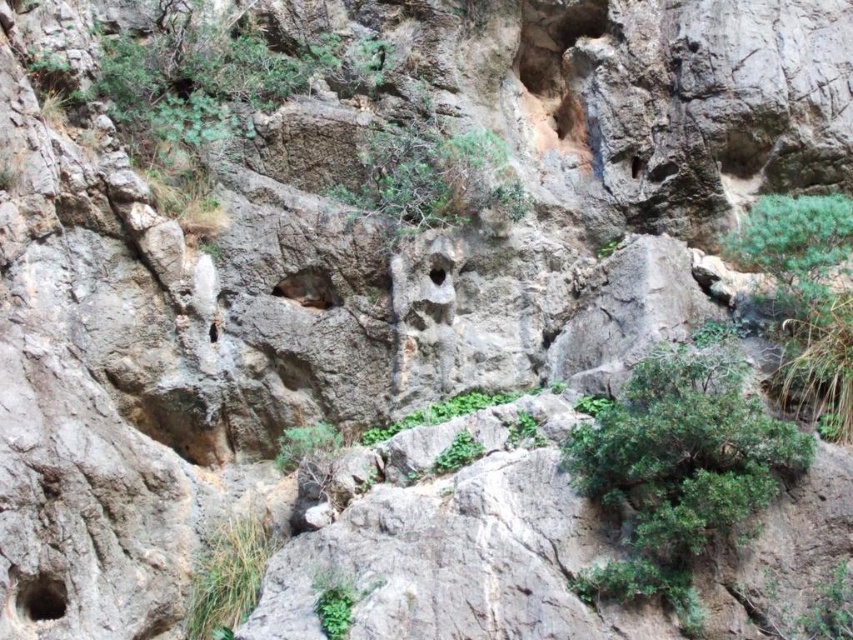
Question: Is green leafy shrub at center to the right of green grass at lower left from the viewer's perspective?

Choices:
 (A) no
 (B) yes

Answer: (B)

Question: Observing the image, what is the correct spatial positioning of green leafy shrub at right in reference to smooth stone hole at lower left?

Choices:
 (A) left
 (B) right

Answer: (B)

Question: Which object is the closest to the brown rough hole at center-left?

Choices:
 (A) green grass at lower left
 (B) green leafy shrub at right
 (C) smooth stone hole at center
 (D) green leafy shrub at center

Answer: (C)

Question: Does green leafy shrub at center have a smaller size compared to smooth stone hole at lower left?

Choices:
 (A) no
 (B) yes

Answer: (A)

Question: Considering the real-world distances, which object is farthest from the green leafy bush at center?

Choices:
 (A) green grass at lower left
 (B) smooth stone hole at lower left
 (C) smooth stone hole at center

Answer: (B)

Question: Which object is closer to the camera taking this photo?

Choices:
 (A) green grass at lower left
 (B) green leafy shrub at right

Answer: (A)